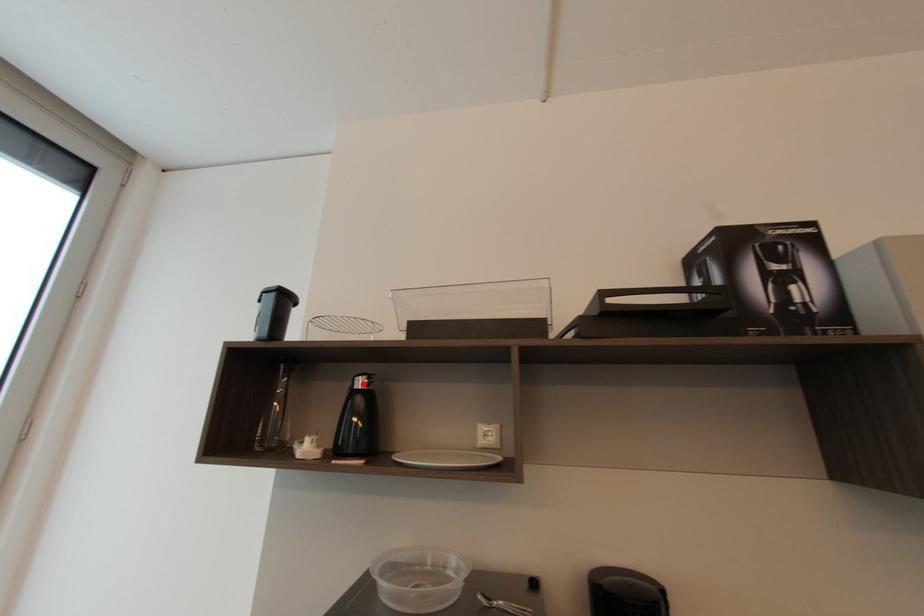
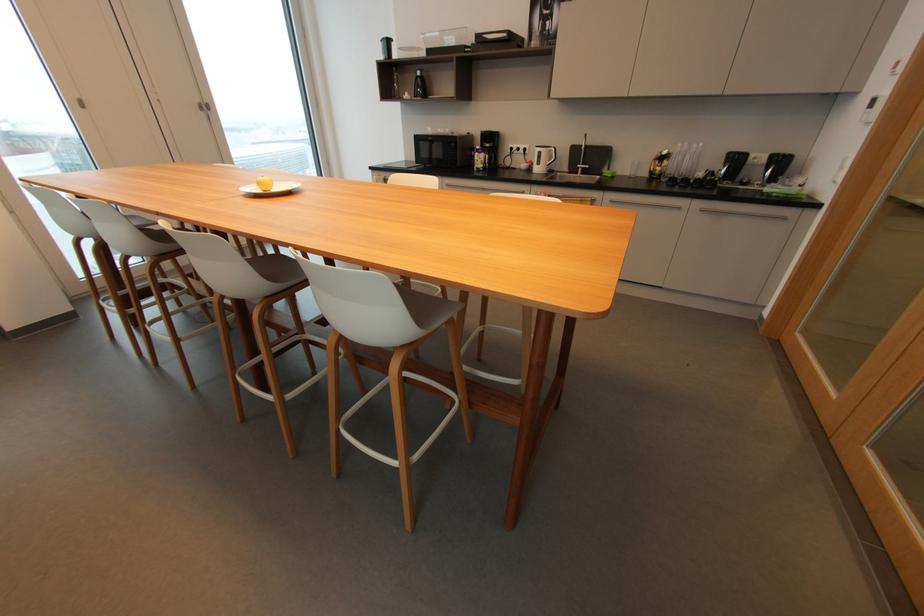
Find the pixel in the second image that matches the highlighted location in the first image.

(421, 74)